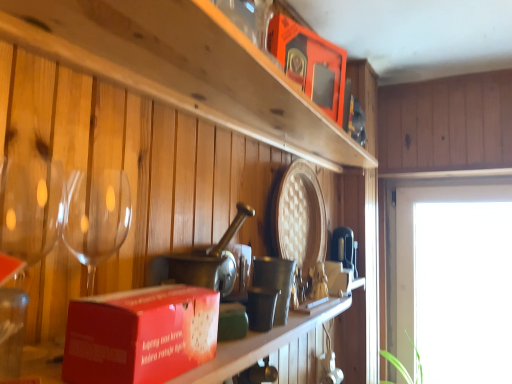
Where is `unoccupied area in front of matte orange box at upper center, the 2th box ordered from the bottom`? The height and width of the screenshot is (384, 512). unoccupied area in front of matte orange box at upper center, the 2th box ordered from the bottom is located at coordinates (288, 108).